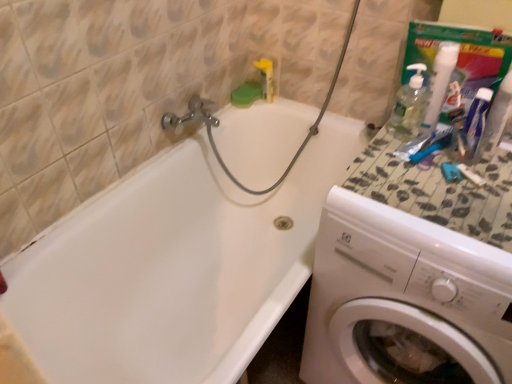
Question: Would you say white glossy bathtub at upper left is inside or outside white plastic washing machine at right?

Choices:
 (A) inside
 (B) outside

Answer: (B)

Question: From a real-world perspective, is white glossy bathtub at upper left physically located above or below white plastic washing machine at right?

Choices:
 (A) above
 (B) below

Answer: (B)

Question: Which is nearer to the speckled stone countertop at right?

Choices:
 (A) white plastic washing machine at right
 (B) yellow plastic toothbrush at upper center
 (C) white glossy bathtub at upper left
 (D) white pump bottle at upper right, the 1th cleaning product viewed from the right
 (E) white plastic toothpaste at upper right

Answer: (E)

Question: Which is farther from the speckled stone countertop at right?

Choices:
 (A) yellow plastic toothbrush at upper center
 (B) white pump bottle at upper right, which is counted as the 2th cleaning product, starting from the left
 (C) white plastic toothpaste at upper right
 (D) white glossy bathtub at upper left
 (E) white plastic washing machine at right

Answer: (A)